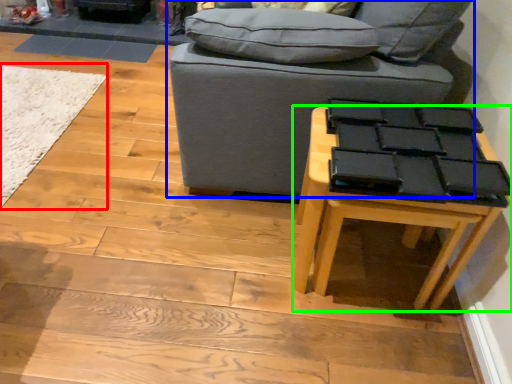
Question: Which object is the farthest from mat (highlighted by a red box)? Choose among these: studio couch (highlighted by a blue box) or table (highlighted by a green box).

Choices:
 (A) studio couch
 (B) table

Answer: (B)